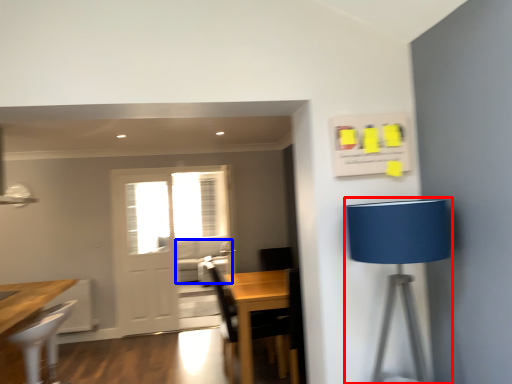
Question: Which object is further to the camera taking this photo, table lamp (highlighted by a red box) or couch (highlighted by a blue box)?

Choices:
 (A) table lamp
 (B) couch

Answer: (B)